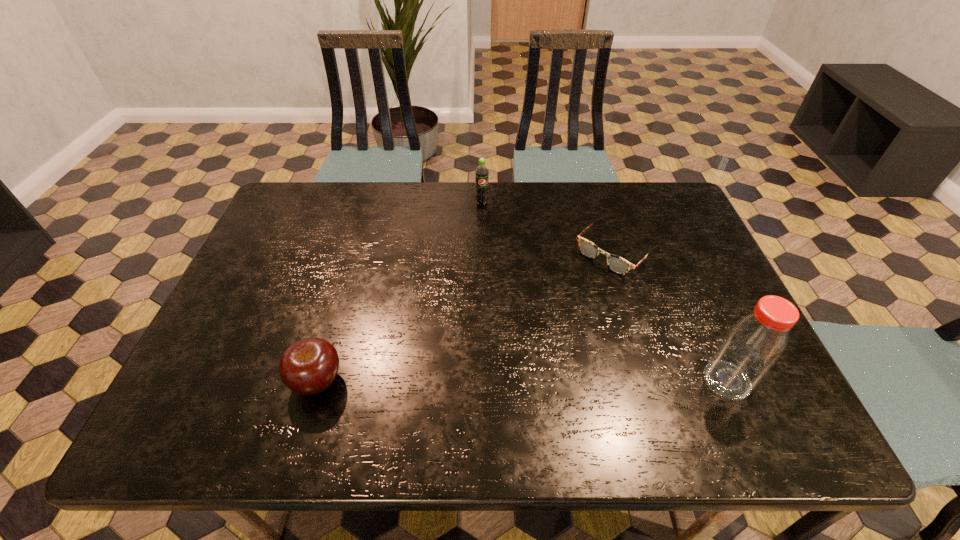
This screenshot has width=960, height=540. In order to click on apple in this screenshot , I will do `click(309, 366)`.

The image size is (960, 540). Find the location of `the leftmost object`. the leftmost object is located at coordinates (309, 366).

Where is `bottle`? This screenshot has height=540, width=960. bottle is located at coordinates (752, 346).

Identify the location of spectacles. (617, 264).

The height and width of the screenshot is (540, 960). In order to click on the second farthest object in this screenshot , I will do `click(617, 264)`.

Identify the location of soda. The width and height of the screenshot is (960, 540). (481, 173).

In order to click on the farthest object in this screenshot , I will do `click(481, 173)`.

Identify the location of vacant region located 0.360m on the right of the leftmost object. (510, 381).

You are a GUI agent. You are given a task and a screenshot of the screen. Output one action in this format:
    pyautogui.click(x=<x>, y=<y>)
    Task: Click on the free region located on the back of the bottle
    The image size is (960, 540).
    Given the screenshot: What is the action you would take?
    pyautogui.click(x=684, y=283)

What are the coordinates of `vacant region located on the frame of the third nearest object` in the screenshot? It's located at (563, 302).